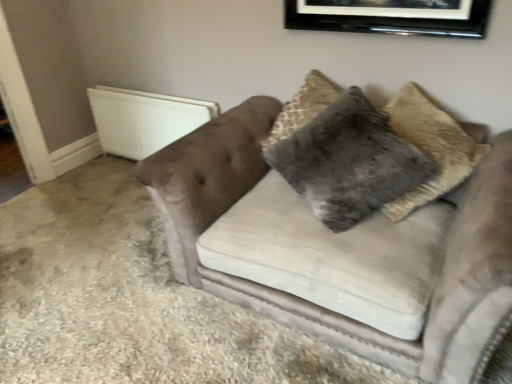
I want to click on black glossy picture frame at upper center, so click(391, 16).

Identify the location of white plastic radiator at left. The height and width of the screenshot is (384, 512). (144, 119).

Looking at their sizes, would you say white plastic radiator at left is wider or thinner than fuzzy gray pillow at center?

Clearly, white plastic radiator at left has less width compared to fuzzy gray pillow at center.

Image resolution: width=512 pixels, height=384 pixels. What are the coordinates of `radiator on the left of the fuzzy gray pillow at center` in the screenshot? It's located at (144, 119).

In the scene shown: Considering the relative sizes of white plastic radiator at left and fuzzy gray pillow at center in the image provided, is white plastic radiator at left bigger than fuzzy gray pillow at center?

No, white plastic radiator at left is not bigger than fuzzy gray pillow at center.

From a real-world perspective, between white plastic radiator at left and fuzzy gray pillow at center, who is vertically higher?

In real-world perspective, fuzzy gray pillow at center is above.

Is point (209, 163) closer or farther from the camera than point (312, 201)?

Point (209, 163) is farther from the camera than point (312, 201).

Which is more to the left, velvet couch at center or fuzzy gray pillow at center?

From the viewer's perspective, fuzzy gray pillow at center appears more on the left side.

From the image's perspective, which object appears higher, velvet couch at center or fuzzy gray pillow at center?

fuzzy gray pillow at center appears higher in the image.

From a real-world perspective, is velvet couch at center positioned over fuzzy gray pillow at center based on gravity?

Actually, velvet couch at center is physically below fuzzy gray pillow at center in the real world.

Are velvet couch at center and white plastic radiator at left located far from each other?

That's right, there is a large distance between velvet couch at center and white plastic radiator at left.

What's the angular difference between velvet couch at center and white plastic radiator at left's facing directions?

There is a 0.245-degree angle between the facing directions of velvet couch at center and white plastic radiator at left.

Looking at the image, does velvet couch at center seem bigger or smaller compared to white plastic radiator at left?

Clearly, velvet couch at center is larger in size than white plastic radiator at left.

From their relative heights in the image, would you say black glossy picture frame at upper center is taller or shorter than fuzzy gray pillow at center?

Considering their sizes, black glossy picture frame at upper center has less height than fuzzy gray pillow at center.

Which is in front, black glossy picture frame at upper center or fuzzy gray pillow at center?

fuzzy gray pillow at center is more forward.

In order to click on pillow lying below the black glossy picture frame at upper center (from the image's perspective) in this screenshot , I will do `click(349, 162)`.

Is black glossy picture frame at upper center to the left or to the right of fuzzy gray pillow at center in the image?

black glossy picture frame at upper center is positioned on fuzzy gray pillow at center's right side.

Considering the relative positions of fuzzy gray pillow at center and velvet couch at center in the image provided, is fuzzy gray pillow at center to the right of velvet couch at center from the viewer's perspective?

No.

Where is `studio couch in front of the fuzzy gray pillow at center`? The image size is (512, 384). studio couch in front of the fuzzy gray pillow at center is located at coordinates (342, 250).

Is fuzzy gray pillow at center oriented towards velvet couch at center?

Yes, fuzzy gray pillow at center is turned towards velvet couch at center.

From a real-world perspective, which object stands above the other?

In real-world perspective, black glossy picture frame at upper center is above.

Is white plastic radiator at left facing away from black glossy picture frame at upper center?

No, white plastic radiator at left is not facing the opposite direction of black glossy picture frame at upper center.

Is white plastic radiator at left taller than black glossy picture frame at upper center?

Indeed, white plastic radiator at left has a greater height compared to black glossy picture frame at upper center.

Considering the relative positions of white plastic radiator at left and black glossy picture frame at upper center in the image provided, is white plastic radiator at left to the right of black glossy picture frame at upper center from the viewer's perspective?

No.

Which object is wider, white plastic radiator at left or velvet couch at center?

With larger width is velvet couch at center.

Considering the relative sizes of white plastic radiator at left and velvet couch at center in the image provided, is white plastic radiator at left smaller than velvet couch at center?

Correct, white plastic radiator at left occupies less space than velvet couch at center.

Who is shorter, white plastic radiator at left or velvet couch at center?

Standing shorter between the two is white plastic radiator at left.

Where is `radiator above the fuzzy gray pillow at center (from the image's perspective)`? The height and width of the screenshot is (384, 512). radiator above the fuzzy gray pillow at center (from the image's perspective) is located at coordinates (144, 119).

Identify the location of pillow that appears on the left of velvet couch at center. This screenshot has width=512, height=384. (349, 162).

When comparing their distances from velvet couch at center, does white plastic radiator at left or black glossy picture frame at upper center seem closer?

The object closer to velvet couch at center is black glossy picture frame at upper center.

Based on their spatial positions, is fuzzy gray pillow at center or black glossy picture frame at upper center closer to white plastic radiator at left?

fuzzy gray pillow at center is closer to white plastic radiator at left.

Estimate the real-world distances between objects in this image. Which object is closer to fuzzy gray pillow at center, white plastic radiator at left or black glossy picture frame at upper center?

black glossy picture frame at upper center is positioned closer to the anchor fuzzy gray pillow at center.

Looking at the image, which one is located closer to black glossy picture frame at upper center, fuzzy gray pillow at center or white plastic radiator at left?

fuzzy gray pillow at center lies closer to black glossy picture frame at upper center than the other object.

From the image, which object appears to be nearer to white plastic radiator at left, velvet couch at center or black glossy picture frame at upper center?

velvet couch at center.

Estimate the real-world distances between objects in this image. Which object is closer to velvet couch at center, fuzzy gray pillow at center or white plastic radiator at left?

The object closer to velvet couch at center is fuzzy gray pillow at center.

Considering their positions, is velvet couch at center positioned further to fuzzy gray pillow at center than white plastic radiator at left?

Based on the image, white plastic radiator at left appears to be further to fuzzy gray pillow at center.

When comparing their distances from fuzzy gray pillow at center, does black glossy picture frame at upper center or white plastic radiator at left seem further?

The object further to fuzzy gray pillow at center is white plastic radiator at left.

The width and height of the screenshot is (512, 384). I want to click on pillow positioned between velvet couch at center and white plastic radiator at left from near to far, so click(349, 162).

I want to click on pillow between black glossy picture frame at upper center and velvet couch at center vertically, so click(349, 162).

The image size is (512, 384). Find the location of `pillow located between white plastic radiator at left and black glossy picture frame at upper center in the left-right direction`. pillow located between white plastic radiator at left and black glossy picture frame at upper center in the left-right direction is located at coordinates (349, 162).

Identify the location of picture frame between velvet couch at center and white plastic radiator at left from front to back. (391, 16).